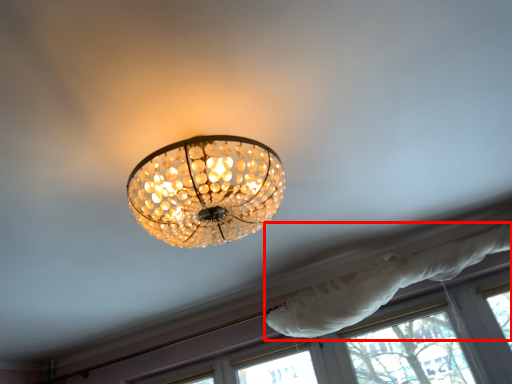
Question: From the image's perspective, what is the correct spatial relationship of curtain (annotated by the red box) in relation to window?

Choices:
 (A) above
 (B) below

Answer: (A)